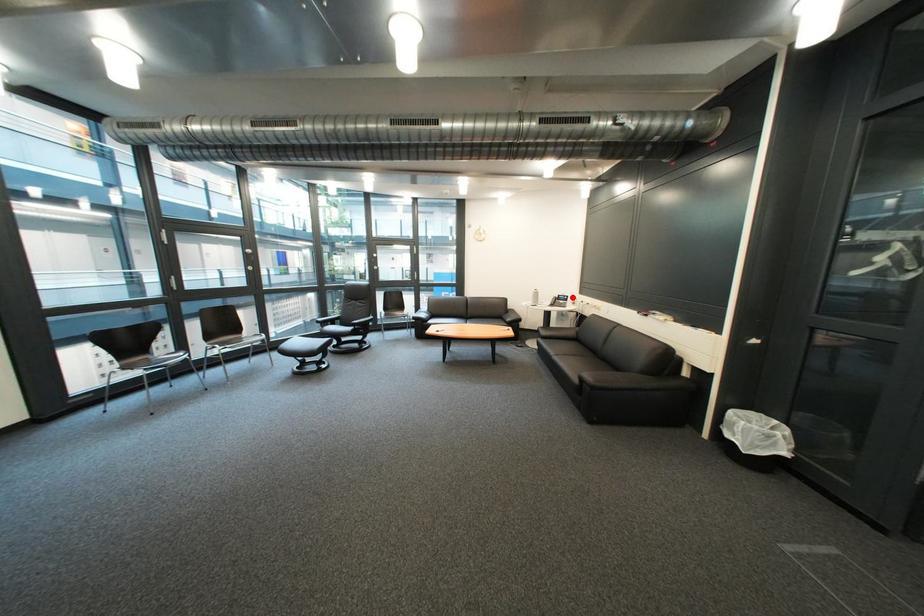
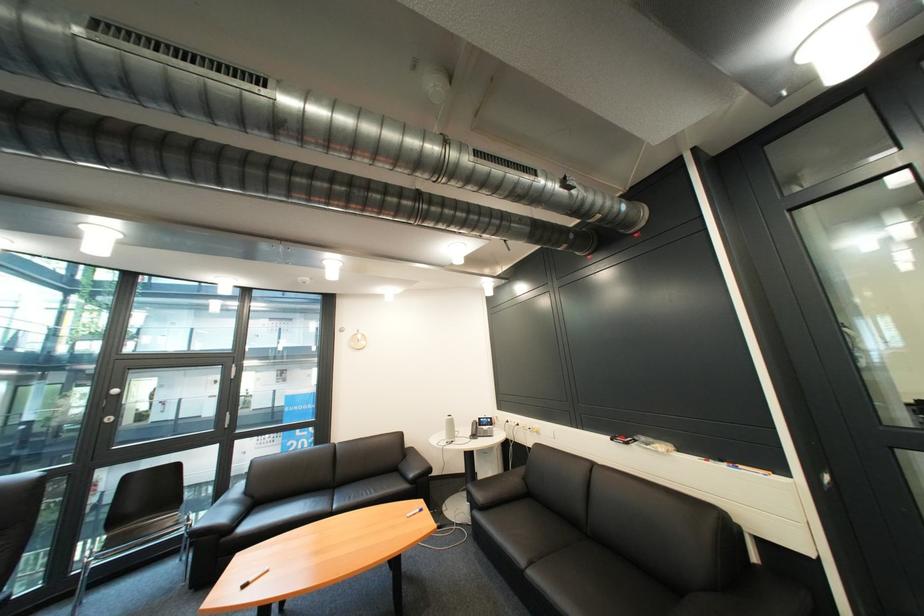
The point at the highlighted location is marked in the first image. Where is the corresponding point in the second image?

(492, 419)